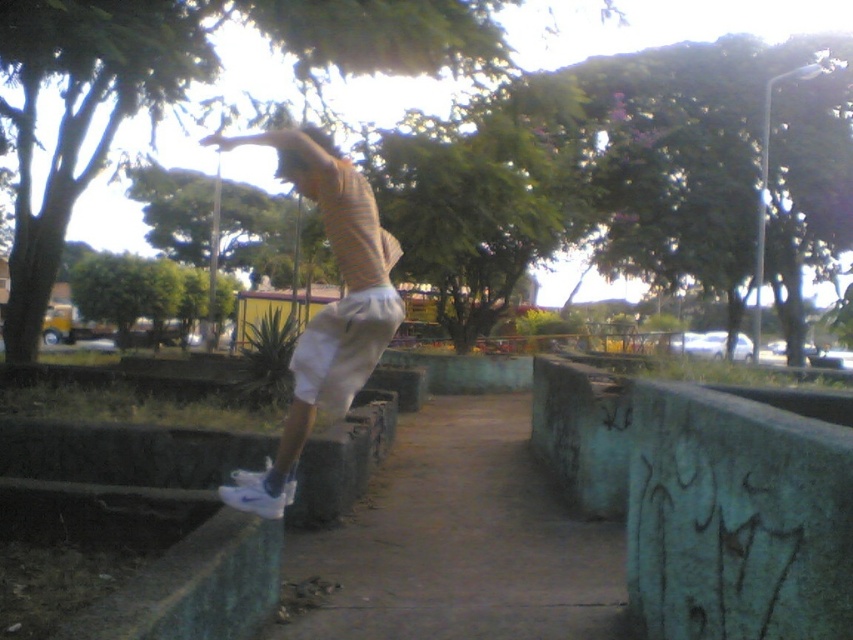
You are a drone operator trying to capture a photo of the person performing parkour. The camera is currently focused on the point at coordinates point (460, 541). What object is the camera focused on?

The camera is focused on the green concrete pavement at center, which corresponds to the point (460, 541).

You are a photographer trying to capture the perfect shot of the parkour athlete. You notice two specific points in the scene marked as point 1 at coordinates (386,584) and point 2 at (386,317). Which point is closer to your camera lens?

Point 1 at coordinates (386,584) is closer to the camera lens because it is further to the viewer than point 2 at (386,317).

You are a parkour athlete preparing to land on the green concrete pavement at center after a jump. Your white matte sneakers at center need to fully touch the ground without any part hanging off. Based on the scene, can you safely land your entire sneakers on the pavement?

The green concrete pavement at center might be wider than white matte sneakers at center, so there is a possibility that the sneakers can fit entirely on the pavement. However, the exact dimensions are uncertain, so caution is advised.